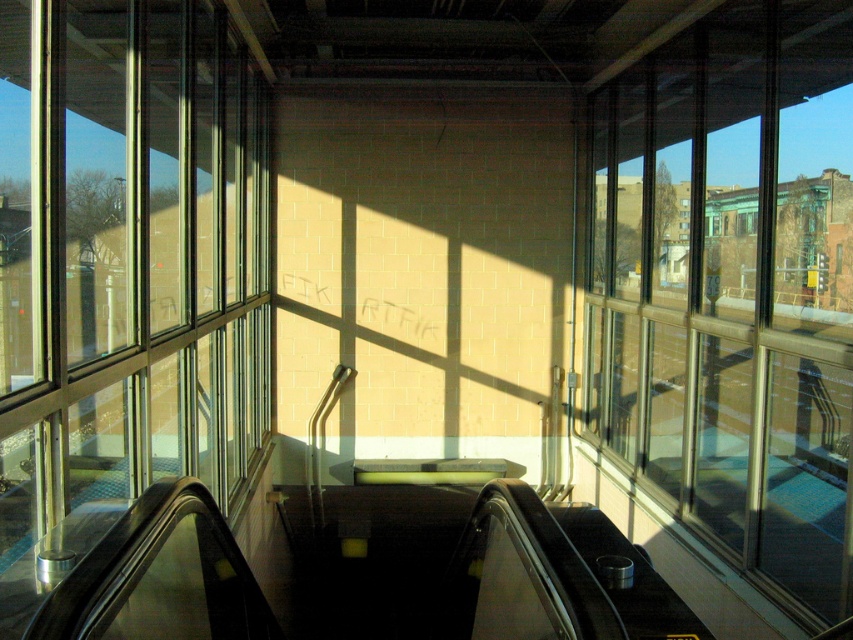
Question: Among these objects, which one is nearest to the camera?

Choices:
 (A) transparent glass window at right
 (B) transparent glass windows at left

Answer: (A)

Question: Can you confirm if transparent glass window at right is positioned to the left of transparent glass windows at left?

Choices:
 (A) yes
 (B) no

Answer: (B)

Question: Is transparent glass window at right to the right of transparent glass windows at left from the viewer's perspective?

Choices:
 (A) yes
 (B) no

Answer: (A)

Question: Can you confirm if transparent glass window at right is thinner than transparent glass windows at left?

Choices:
 (A) no
 (B) yes

Answer: (A)